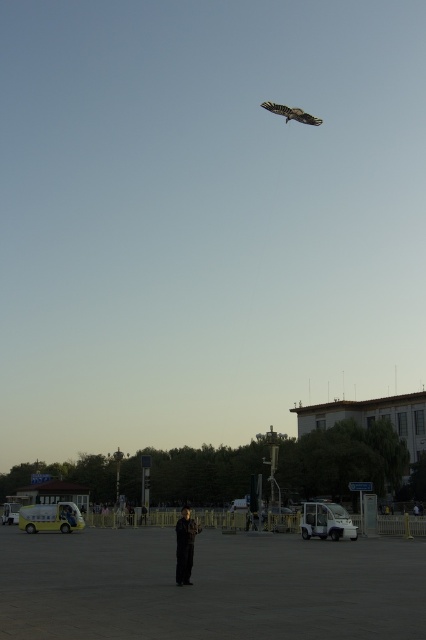
Is point (190, 550) farther from viewer compared to point (302, 122)?

No, it is in front of (302, 122).

Consider the image. Does dark gray suit at center have a greater height compared to brown wooden kite at upper center?

Yes, dark gray suit at center is taller than brown wooden kite at upper center.

Is point (178, 577) farther from camera compared to point (296, 108)?

No, (178, 577) is closer to viewer.

Where is `dark gray suit at center`? Image resolution: width=426 pixels, height=640 pixels. dark gray suit at center is located at coordinates (184, 547).